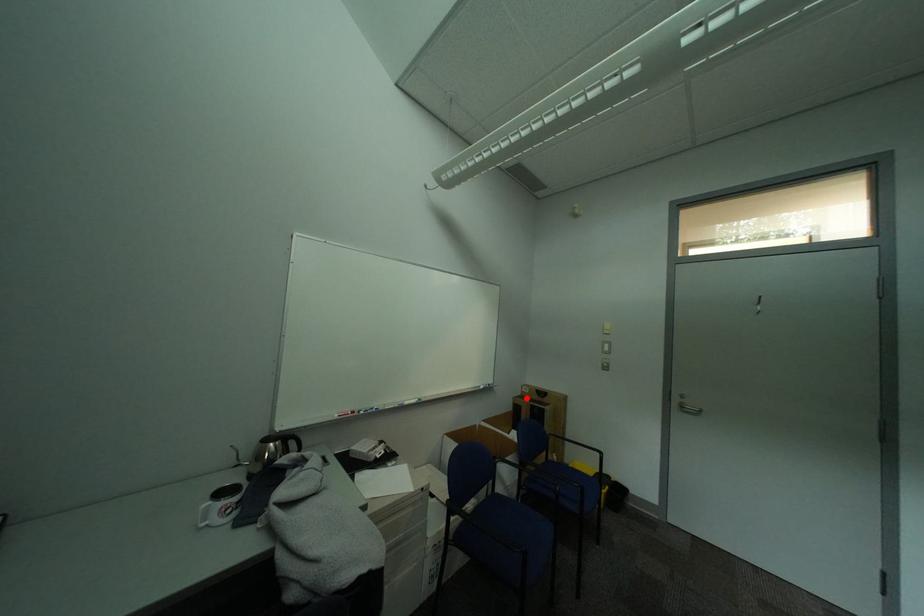
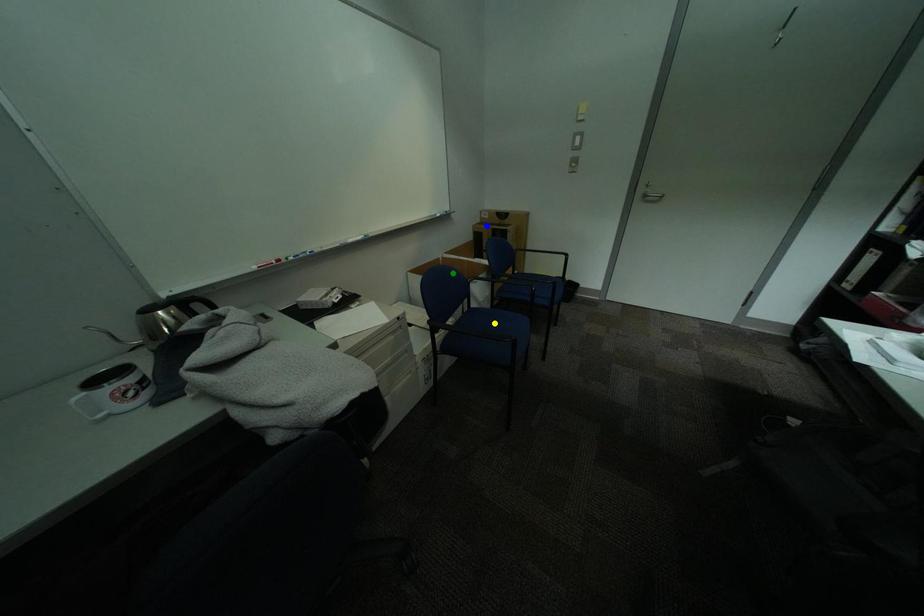
Question: I am providing you with two images of the same scene from different viewpoints. A red point is marked on the first image. You are given multiple points on the second image. Which point in image 2 represents the same 3d spot as the red point in image 1?

Choices:
 (A) yellow point
 (B) blue point
 (C) green point

Answer: (B)